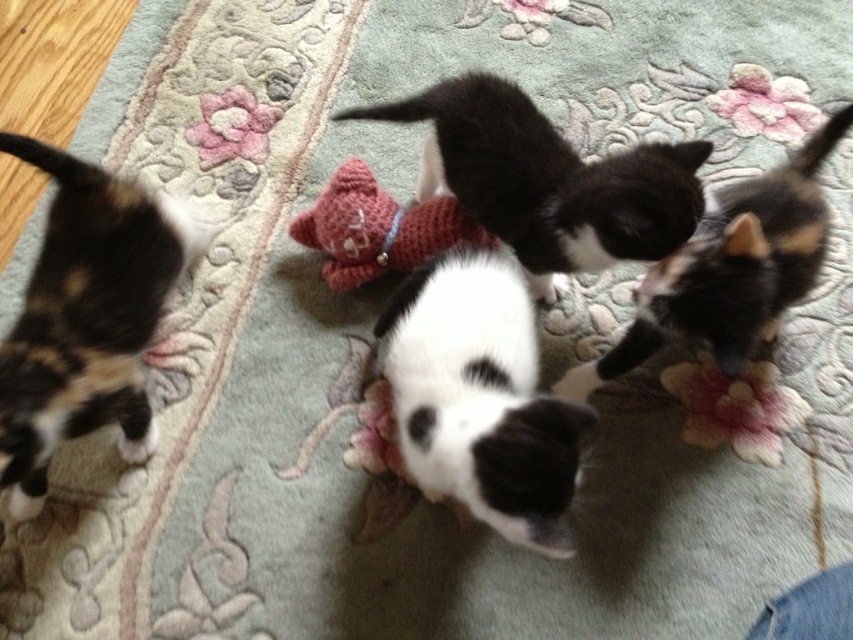
You are a cat owner who wants to place a knitted pink toy at center in front of the calico fur cat at left. Is the toy small enough to fit in front of the cat without overlapping?

The calico fur cat at left is larger in size than the knitted pink toy at center, so the toy can be placed in front of the cat without overlapping since it is smaller in size.

You are a cat owner who wants to buy a new toy for your black matte fur cat at center. The store has a knitted pink toy at center that is exactly the same size as the cat. Will this toy be a good fit for your cat?

The black matte fur cat at center is wider than the knitted pink toy at center, so the toy may be too small for the cat. Consider choosing a larger toy instead.

You are a photographer trying to capture a closeup of the black and white kitten in the center. You have a focus point at point (27, 419) and another at point (438, 195). Which focus point should you use to ensure the black and white kitten in the center is in focus?

You should use the focus point at point (27, 419) because it is closer to the camera than point (438, 195), making it better suited to capture the black and white kitten in the center in focus.